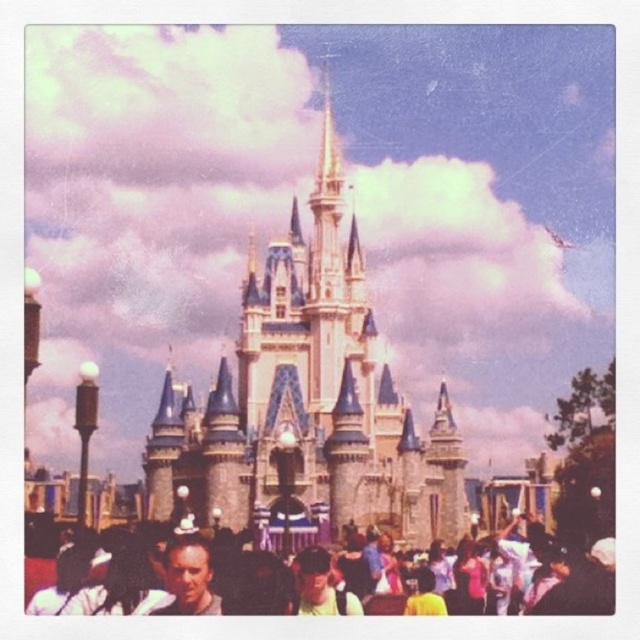
You are standing at the origin point of the coordinate system in the image. The multicolored fabric crowd at lower center is located at point 0.905, 0.505. If you want to move towards the castle, which direction should you go?

Since the multicolored fabric crowd at lower center is located at point (323, 579), you should move towards the negative y direction to reach the castle.

You are standing at the coordinates point 0.5, 0.5 in the image. Which direction should you move to reach the white stone castle at center?

Since the white stone castle at center is located at point (x=307, y=404) and you are at point (x=320, y=320), you should move northeast to reach it.

From the picture: You are a tourist standing at the entrance of the white stone castle at center. You want to take a photo of the golden spire on the central tower without the multicolored fabric crowd at lower center blocking your view. Is this possible?

The white stone castle at center is located above the multicolored fabric crowd at lower center, so you can take a photo of the golden spire on the central tower without the crowd blocking your view.